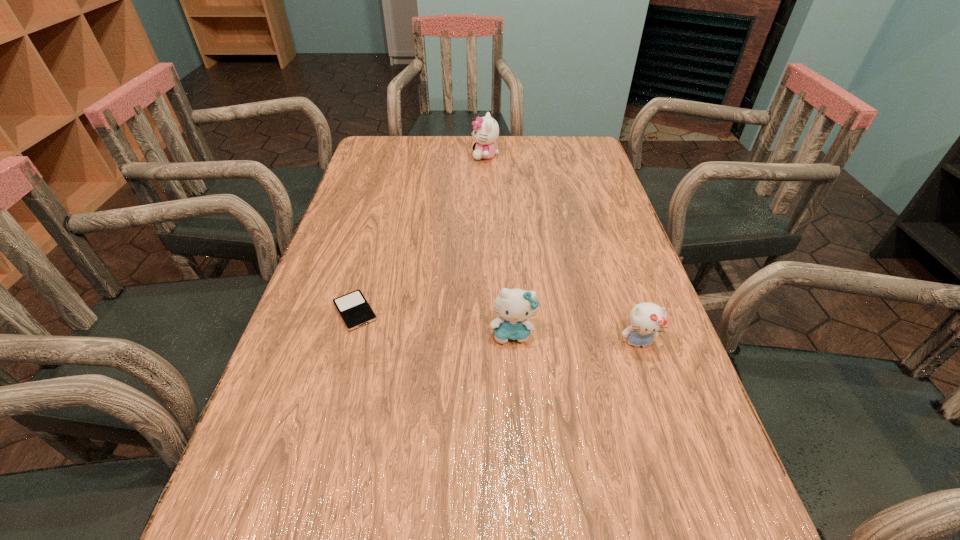
At what (x,y) coordinates should I click in order to perform the action: click on kitten that is the closest to the rightmost object. Please return your answer as a coordinate pair (x, y). Looking at the image, I should click on pyautogui.click(x=515, y=306).